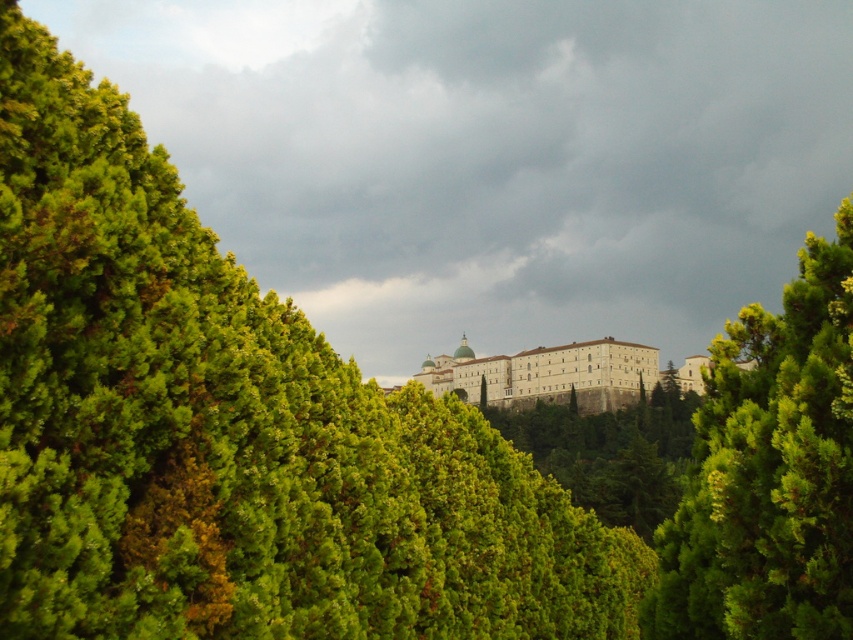
You are an architect analyzing the landscape composition. Based on the provided scene, which object takes up more visual space in the image between the green leafy tree at right and the white stone building at center?

The white stone building at center takes up more visual space than the green leafy tree at right, as stated in the description that the green leafy tree at right occupies less space than the white stone building at center.

You are an astronomer analyzing the image. You need to determine the position of the dark gray cloud at upper center in the image. What are its coordinates?

The dark gray cloud at upper center is located at coordinates point (492, 156).

You are a drone operator planning to fly a drone between the dark gray cloud at upper center and the green leafy tree at right. The drone has a maximum flight range of 150 meters. Can the drone safely travel from one to the other without running out of battery?

The dark gray cloud at upper center and green leafy tree at right are 145.77 meters apart from each other. Since the distance is less than the drone maximum flight range of 150 meters, the drone can safely travel between them without running out of battery.